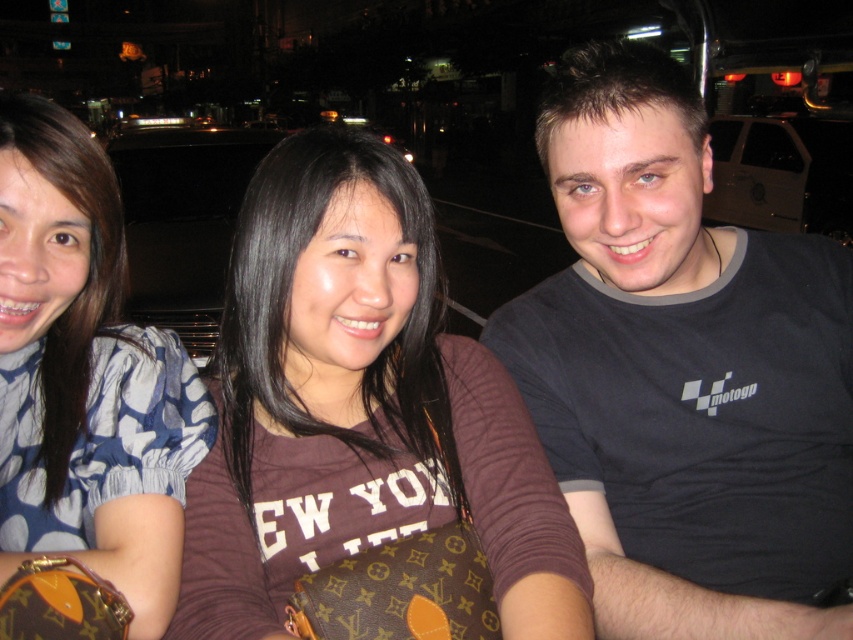
Consider the image. Does dark gray t-shirt at center appear on the right side of brown fabric shirt at center?

Indeed, dark gray t-shirt at center is positioned on the right side of brown fabric shirt at center.

Between point (715, 280) and point (315, 432), which one is positioned behind?

Positioned behind is point (715, 280).

Locate an element on the screen. This screenshot has height=640, width=853. dark gray t-shirt at center is located at coordinates (683, 371).

Can you confirm if dark gray t-shirt at center is bigger than blue dotted blouse at left?

Correct, dark gray t-shirt at center is larger in size than blue dotted blouse at left.

Is point (579, 337) farther from viewer compared to point (62, 161)?

That is True.

You are a GUI agent. You are given a task and a screenshot of the screen. Output one action in this format:
    pyautogui.click(x=<x>, y=<y>)
    Task: Click on the dark gray t-shirt at center
    
    Given the screenshot: What is the action you would take?
    pyautogui.click(x=683, y=371)

Is brown fabric shirt at center positioned at the back of blue dotted blouse at left?

Yes.

Which of these two, brown fabric shirt at center or blue dotted blouse at left, stands taller?

blue dotted blouse at left is taller.

Is point (308, 236) behind point (12, 344)?

No, (308, 236) is closer to viewer.

Locate an element on the screen. This screenshot has width=853, height=640. brown fabric shirt at center is located at coordinates (358, 406).